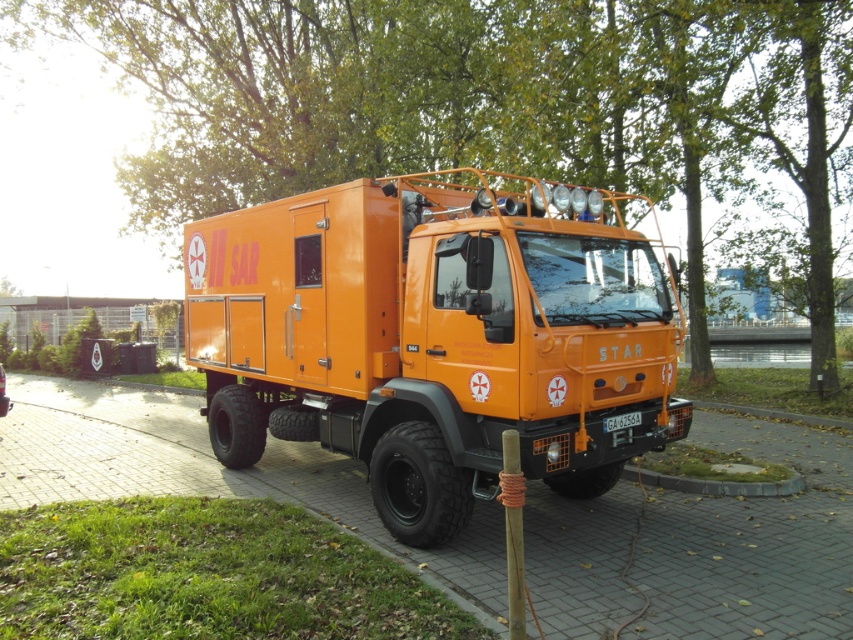
What is the spatial relationship between the orange matte truck at center and the orange rubber pavement at center?

The orange matte truck at center is positioned to the right of the orange rubber pavement at center.

You are a photographer trying to capture the SAR vehicle while ensuring both the green leafy tree at upper center and the black plastic license plate at center are visible in the frame. Which object should you adjust your camera angle to prioritize capturing first if you need to focus on the wider object?

The green leafy tree at upper center should be prioritized because its width surpasses that of the black plastic license plate at center.